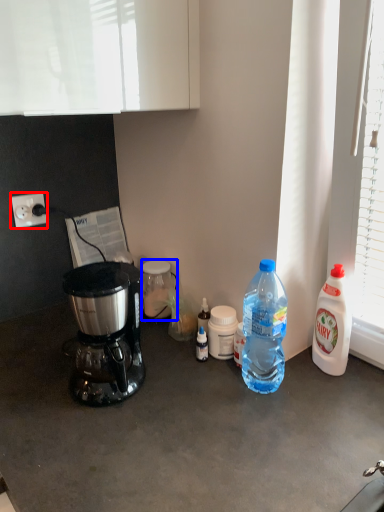
Question: Among these objects, which one is nearest to the camera, power outlet (highlighted by a red box) or bottle (highlighted by a blue box)?

Choices:
 (A) power outlet
 (B) bottle

Answer: (A)